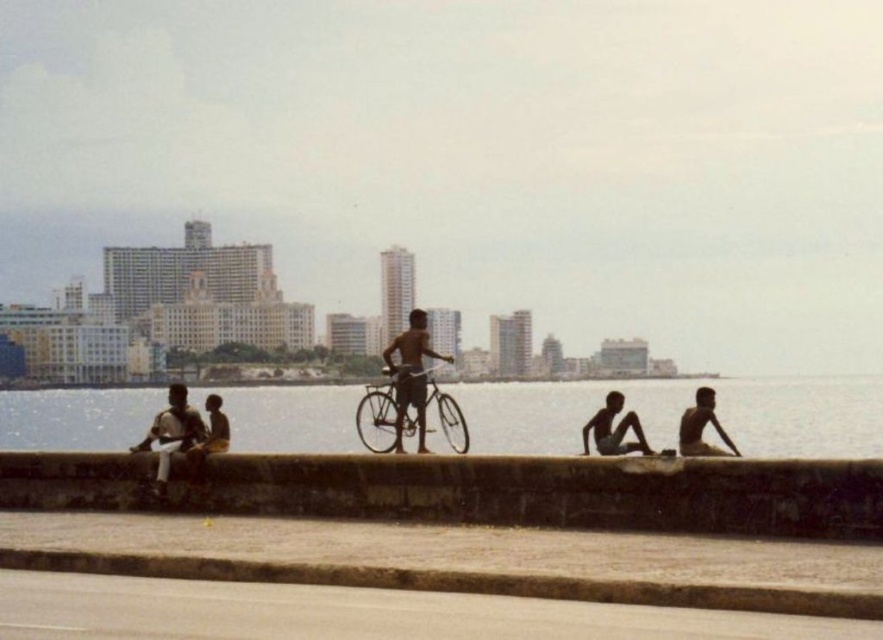
Question: Where is smooth concrete ledge at center located in relation to brown concrete curb at lower center in the image?

Choices:
 (A) above
 (B) below

Answer: (A)

Question: Can you confirm if brown concrete curb at lower center is thinner than silver metallic bicycle at center?

Choices:
 (A) no
 (B) yes

Answer: (A)

Question: Is smooth concrete ledge at center below dark skin human at lower right?

Choices:
 (A) no
 (B) yes

Answer: (B)

Question: Which point appears farthest from the camera in this image?

Choices:
 (A) (793, 484)
 (B) (695, 420)
 (C) (376, 403)

Answer: (C)

Question: Which point appears farthest from the camera in this image?

Choices:
 (A) (600, 394)
 (B) (614, 404)

Answer: (A)

Question: Which point is closer to the camera?

Choices:
 (A) (680, 420)
 (B) (87, 416)

Answer: (A)